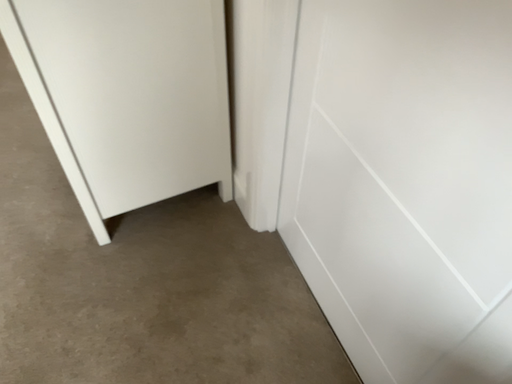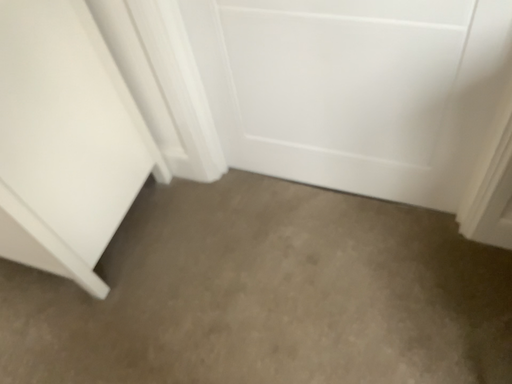
Question: Which way did the camera rotate in the video?

Choices:
 (A) rotated downward
 (B) rotated upward

Answer: (B)